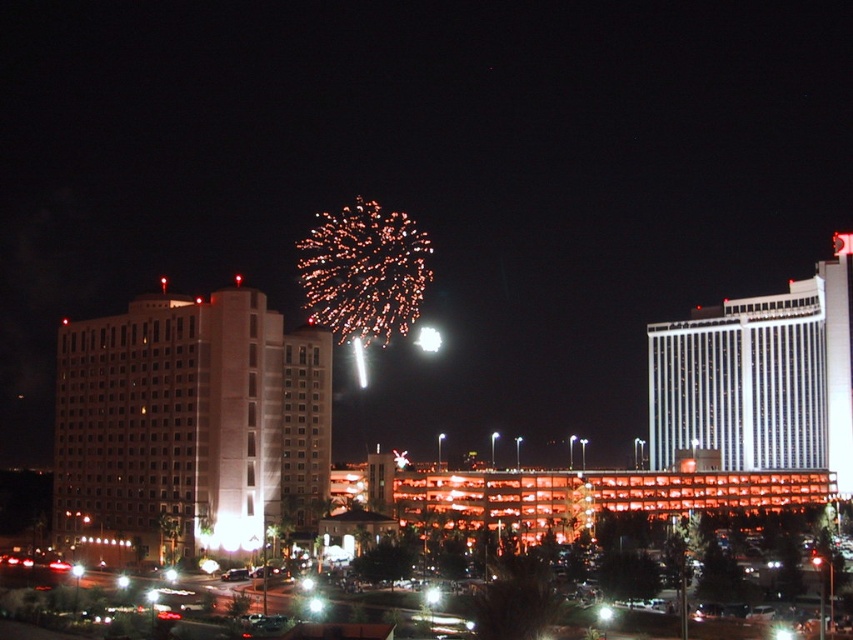
Does matte white building at left have a smaller size compared to white glossy building at upper right?

Correct, matte white building at left occupies less space than white glossy building at upper right.

Locate an element on the screen. The width and height of the screenshot is (853, 640). matte white building at left is located at coordinates (189, 428).

Who is more distant from viewer, (155, 340) or (677, 360)?

The point (677, 360) is behind.

This screenshot has height=640, width=853. I want to click on matte white building at left, so click(x=189, y=428).